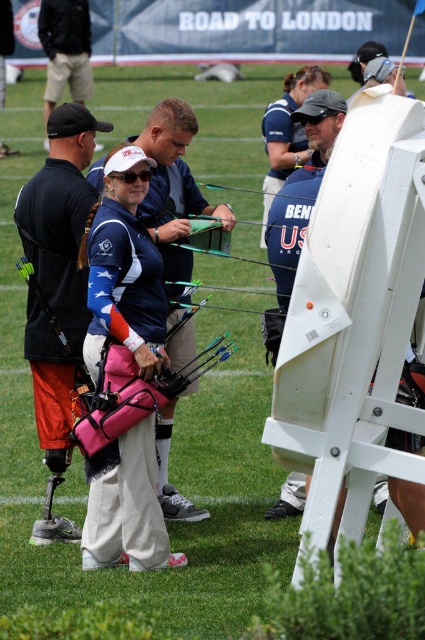
You are an archer standing at the starting line and need to retrieve your pink fabric bag at center. According to the coordinates provided, what direction should you move to reach it?

The pink fabric bag at center is located at coordinates point (57, 294). Since the coordinate system starts at the bottom left corner, moving towards the right increases the x value and moving upward increases the y value. To reach the pink fabric bag at center, you should move right and up from your current position at the starting line.

You are an archer preparing for your turn. You have a pink fabric bag at center and a blue fabric shirt at center. Which item can you place horizontally without folding if you have a storage space that is 1.2 meters wide?

The pink fabric bag at center can be placed horizontally without folding in the 1.2 meters wide storage space since its width is larger than the blue fabric shirt at center, implying it requires more space.

You are an archer participating in the competition and need to retrieve an arrow from your equipment. You see the pink fabric bag at center and the pink fabric bow at center. Which one is located lower?

The pink fabric bag at center is below the pink fabric bow at center, so the pink fabric bag at center is located lower.